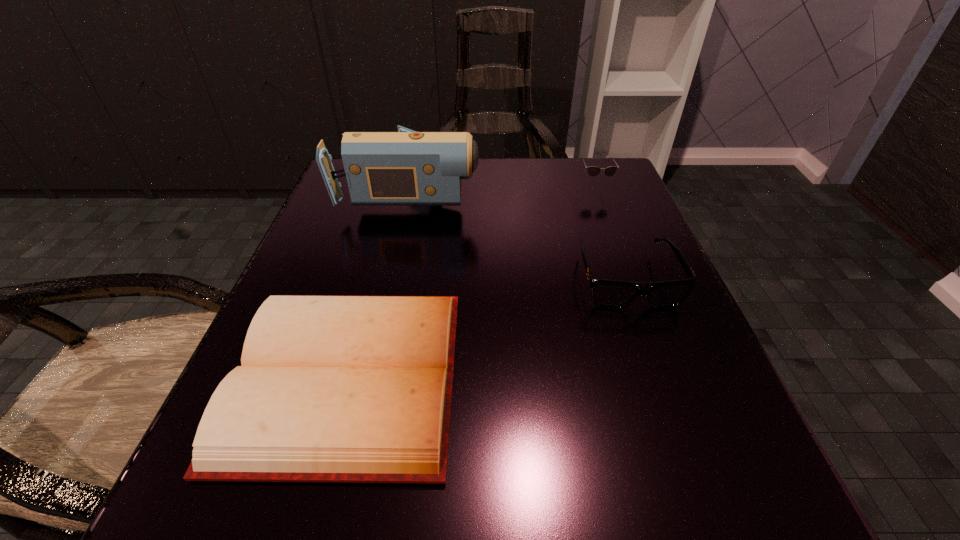
Locate an element on the screen. This screenshot has height=540, width=960. camcorder situated at the far edge is located at coordinates (406, 167).

Find the location of a particular element. The width and height of the screenshot is (960, 540). sunglasses that is at the far edge is located at coordinates (x=593, y=171).

Identify the location of object that is positioned at the near edge. The width and height of the screenshot is (960, 540). (338, 389).

Locate an element on the screen. This screenshot has width=960, height=540. camcorder located at the left edge is located at coordinates (406, 167).

Locate an element on the screen. This screenshot has width=960, height=540. Bible that is at the left edge is located at coordinates (338, 389).

Where is `object at the far left corner`? This screenshot has height=540, width=960. object at the far left corner is located at coordinates (406, 167).

Find the location of a particular element. Image resolution: width=960 pixels, height=540 pixels. object that is at the near left corner is located at coordinates (338, 389).

Locate an element on the screen. object present at the far right corner is located at coordinates (593, 171).

Image resolution: width=960 pixels, height=540 pixels. In the image, there is a desktop. In order to click on vacant area at the far edge in this screenshot , I will do `click(553, 190)`.

This screenshot has height=540, width=960. I want to click on vacant space at the left edge of the desktop, so click(362, 249).